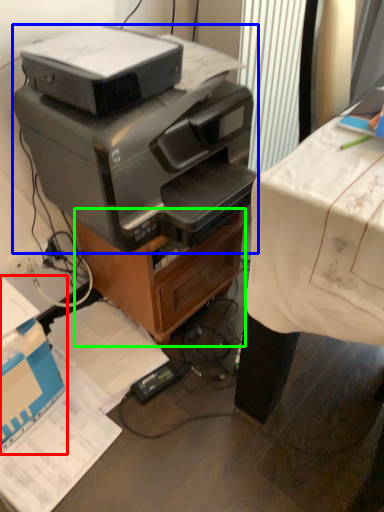
Question: Estimate the real-world distances between objects in this image. Which object is closer to cardboard box (highlighted by a red box), printer (highlighted by a blue box) or file cabinet (highlighted by a green box)?

Choices:
 (A) printer
 (B) file cabinet

Answer: (B)